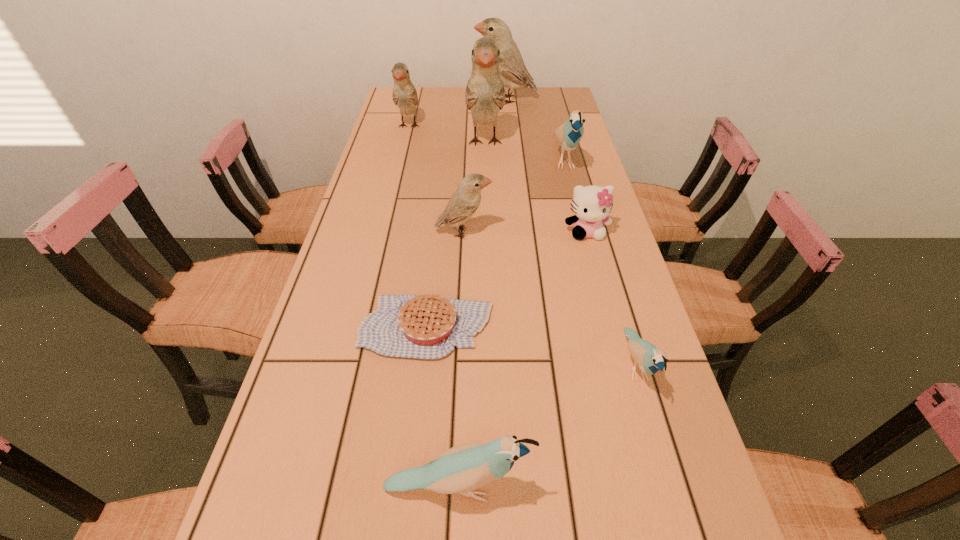
Locate an element on the screen. The height and width of the screenshot is (540, 960). vacant space situated 0.230m at the face of the third biggest white bird is located at coordinates (396, 176).

This screenshot has width=960, height=540. What are the coordinates of `free space located 0.110m at the face of the farthest blue bird` in the screenshot? It's located at click(x=576, y=206).

Identify the location of vacant region located at the face of the smallest white bird. (595, 233).

Where is `free region located 0.140m at the face of the leftmost blue bird`? free region located 0.140m at the face of the leftmost blue bird is located at coordinates (615, 488).

At what (x,y) coordinates should I click in order to perform the action: click on blank space located 0.190m on the front-facing side of the kitten. Please return your answer as a coordinate pair (x, y). Looking at the image, I should click on (604, 296).

Identify the location of vacant space situated 0.050m at the face of the smallest blue bird. This screenshot has width=960, height=540. (655, 431).

Locate an element on the screen. This screenshot has width=960, height=540. vacant area situated 0.190m on the front of the brown pie is located at coordinates (413, 454).

The height and width of the screenshot is (540, 960). I want to click on object that is at the far edge, so click(x=513, y=72).

Locate an element on the screen. bird that is at the left edge is located at coordinates (405, 96).

Locate an element on the screen. This screenshot has height=540, width=960. pie at the left edge is located at coordinates (427, 326).